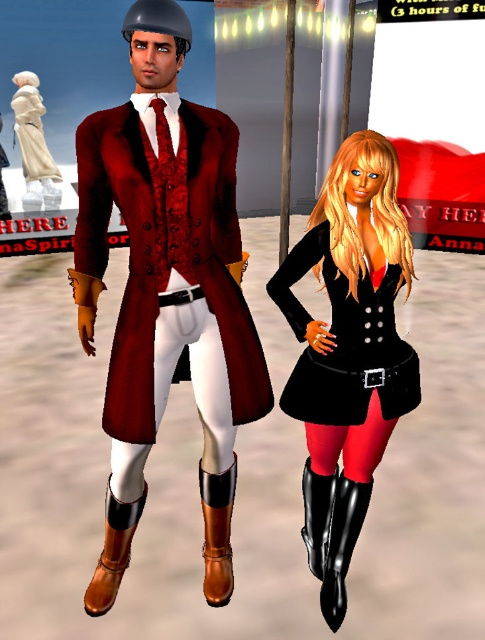
You are a game developer designing a virtual environment where the black satin dress at center and the white porcelain statue at left must fit through a narrow doorway. The doorway has a width of 1.2 meters. Can both objects pass through the doorway simultaneously without touching each other?

The black satin dress at center is wider than the white porcelain statue at left. Since the doorway is 1.2 meters wide, it depends on the combined width of both objects. However, the description only provides the relative size between them, not their exact measurements. Without knowing the exact widths, we cannot determine if they can pass through together.

You are a game developer working on a virtual environment. You need to place a decorative item at the point marked as point (217, 532). Which object from the scene is already located at this point?

The shiny brown leather boot at lower left is located at point (217, 532).